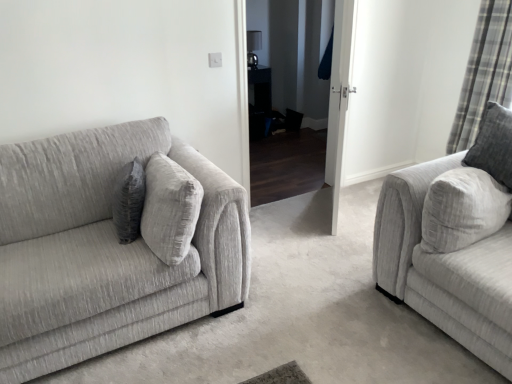
Question: Is plaid fabric curtain at right inside or outside of textured gray couch at right, positioned as the 2th studio couch in left-to-right order?

Choices:
 (A) inside
 (B) outside

Answer: (B)

Question: Considering the positions of plaid fabric curtain at right and textured gray couch at right, which is the 1th studio couch in right-to-left order, in the image, is plaid fabric curtain at right bigger or smaller than textured gray couch at right, which is the 1th studio couch in right-to-left order,?

Choices:
 (A) big
 (B) small

Answer: (B)

Question: Which is nearer to the black glossy table at center?

Choices:
 (A) gray fabric pillow at center
 (B) white glossy door at center
 (C) textured gray couch at left, arranged as the 1th studio couch when viewed from the left
 (D) textured gray couch at right, positioned as the 2th studio couch in left-to-right order
 (E) plaid fabric curtain at right

Answer: (B)

Question: Which of these objects is positioned farthest from the white glossy door at center?

Choices:
 (A) textured gray couch at left, arranged as the 1th studio couch when viewed from the left
 (B) textured gray couch at right, positioned as the 2th studio couch in left-to-right order
 (C) gray fabric pillow at center
 (D) plaid fabric curtain at right
 (E) black glossy table at center

Answer: (E)